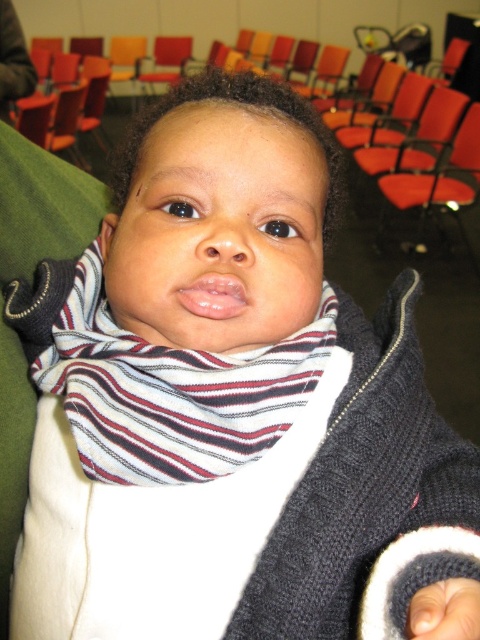
Who is positioned more to the left, white striped scarf at center or orange fabric chair at right?

From the viewer's perspective, white striped scarf at center appears more on the left side.

The width and height of the screenshot is (480, 640). I want to click on white striped scarf at center, so click(170, 390).

This screenshot has height=640, width=480. What are the coordinates of `white striped scarf at center` in the screenshot? It's located at (170, 390).